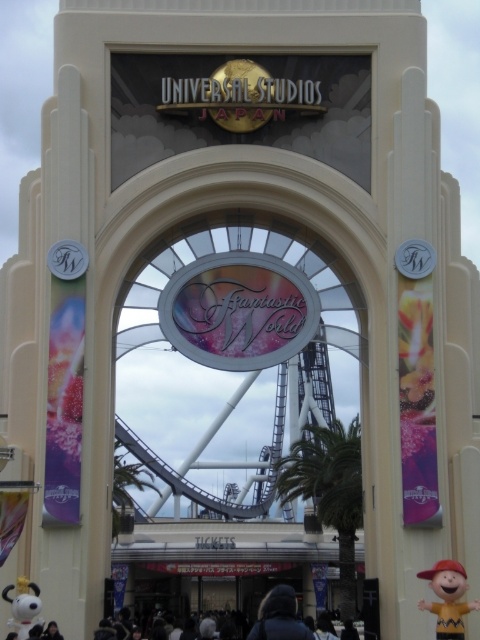
In the scene shown: You are a photographer standing at the entrance of Universal Studios Japan. You want to take a photo that includes both the dark blue jacket at center and the white matte snoopy at lower left. Given that your camera has a maximum focus range of 20 meters, will you be able to capture both subjects in sharp focus?

The dark blue jacket at center and the white matte snoopy at lower left are 18.78 meters apart. Since the distance between them is within the camera maximum focus range of 20 meters, both subjects can be captured in sharp focus.

You are standing in front of the Universal Studios Japan entrance archway and notice a green leafy palm tree at center and a dark blue jacket at center. Which object is closer to you?

The dark blue jacket at center is closer to you because the green leafy palm tree at center is positioned over it, indicating it is behind and thus farther away.